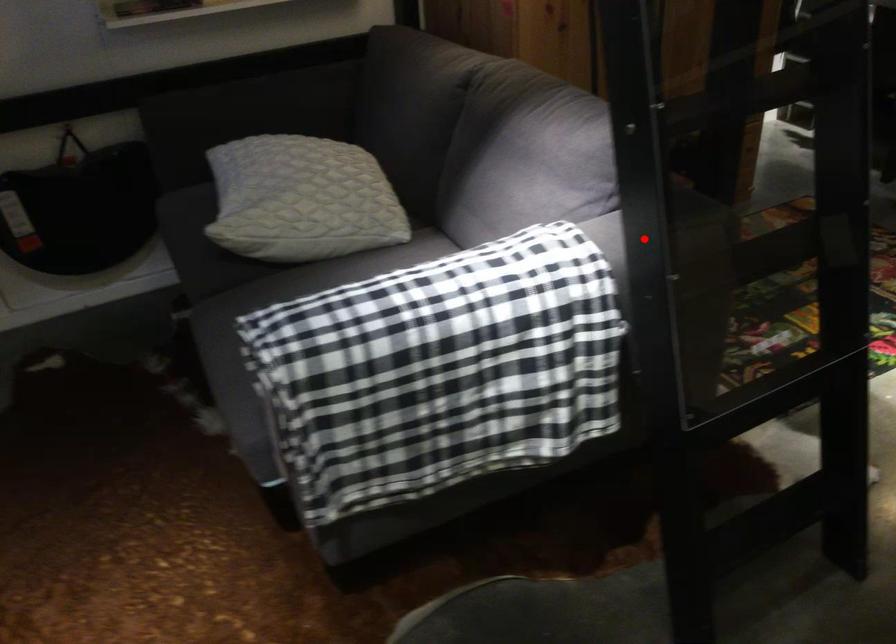
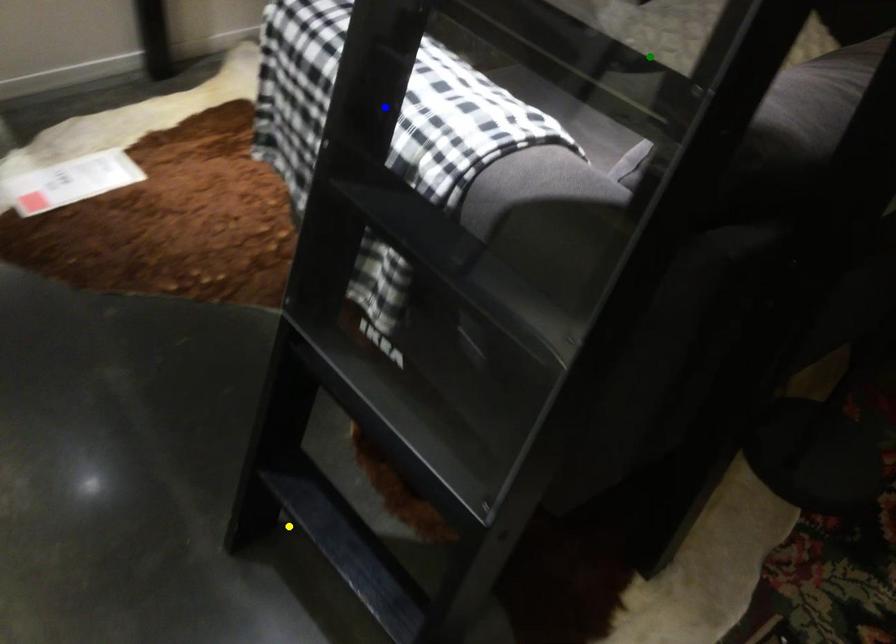
Question: I am providing you with two images of the same scene from different viewpoints. A red point is marked on the first image. You are given multiple points on the second image. Which mark in image 2 goes with the point in image 1?

Choices:
 (A) green point
 (B) blue point
 (C) yellow point

Answer: (B)